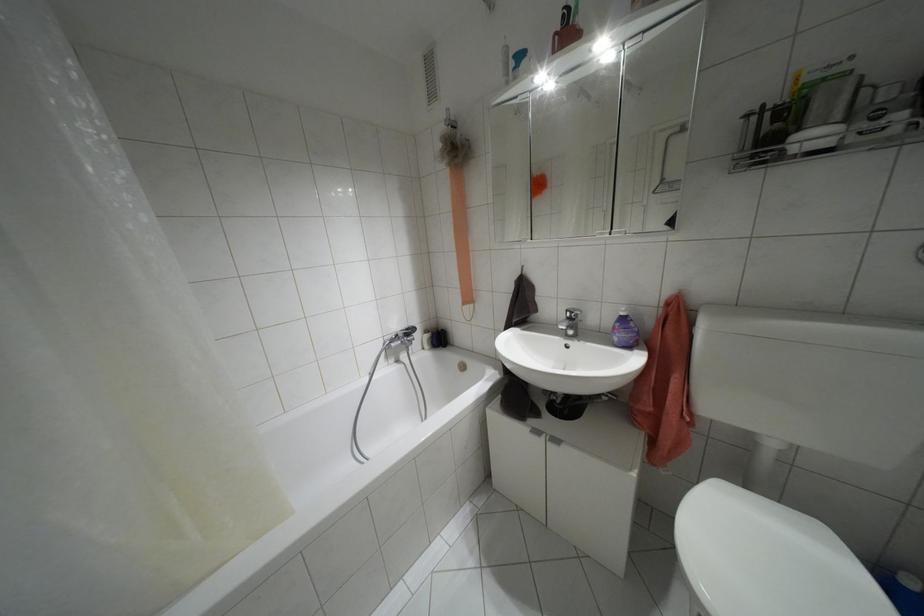
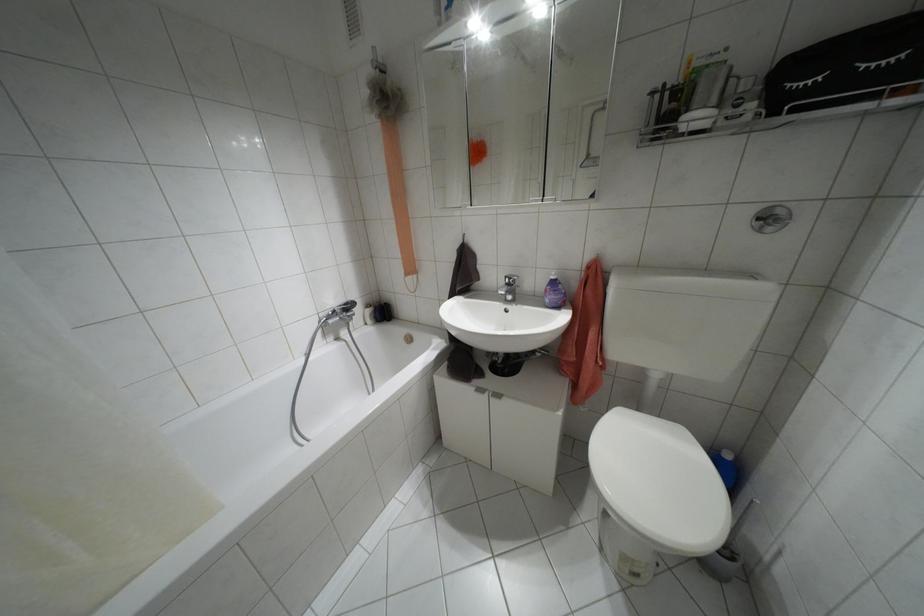
Where in the second image is the point corresponding to point (569, 318) from the first image?

(507, 284)